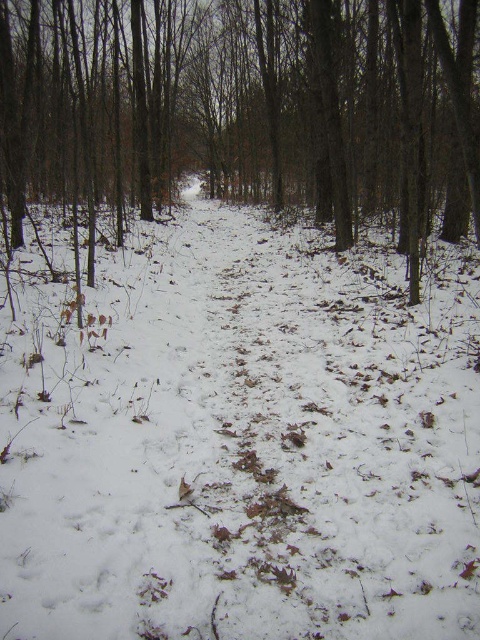
Who is positioned more to the left, white powdery snow at center or brown matte tree at center?

brown matte tree at center

Does white powdery snow at center have a greater width compared to brown matte tree at center?

No, white powdery snow at center is not wider than brown matte tree at center.

This screenshot has height=640, width=480. I want to click on white powdery snow at center, so click(240, 440).

Where is `white powdery snow at center`? The width and height of the screenshot is (480, 640). white powdery snow at center is located at coordinates (240, 440).